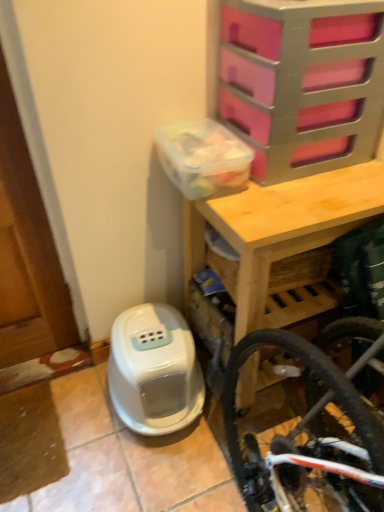
Question: In terms of width, does wooden table at upper center look wider or thinner when compared to pink plastic drawer at upper right?

Choices:
 (A) thin
 (B) wide

Answer: (B)

Question: From their relative heights in the image, would you say wooden table at upper center is taller or shorter than pink plastic drawer at upper right?

Choices:
 (A) short
 (B) tall

Answer: (B)

Question: Based on their relative distances, which object is farther from the wooden table at upper center?

Choices:
 (A) pink plastic drawer at upper right
 (B) white plastic water heater at lower left

Answer: (B)

Question: Which of these objects is positioned closest to the pink plastic drawer at upper right?

Choices:
 (A) wooden table at upper center
 (B) white plastic water heater at lower left

Answer: (A)